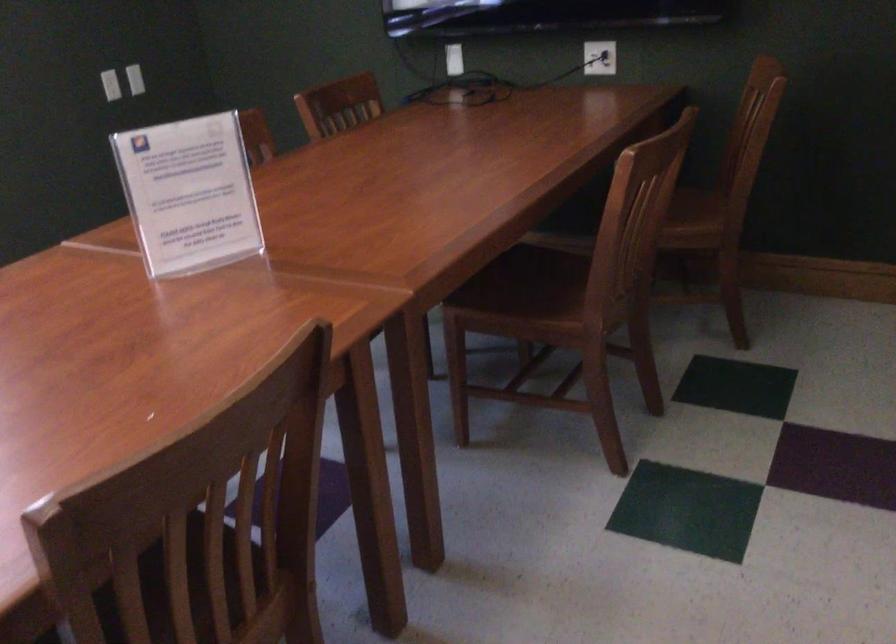
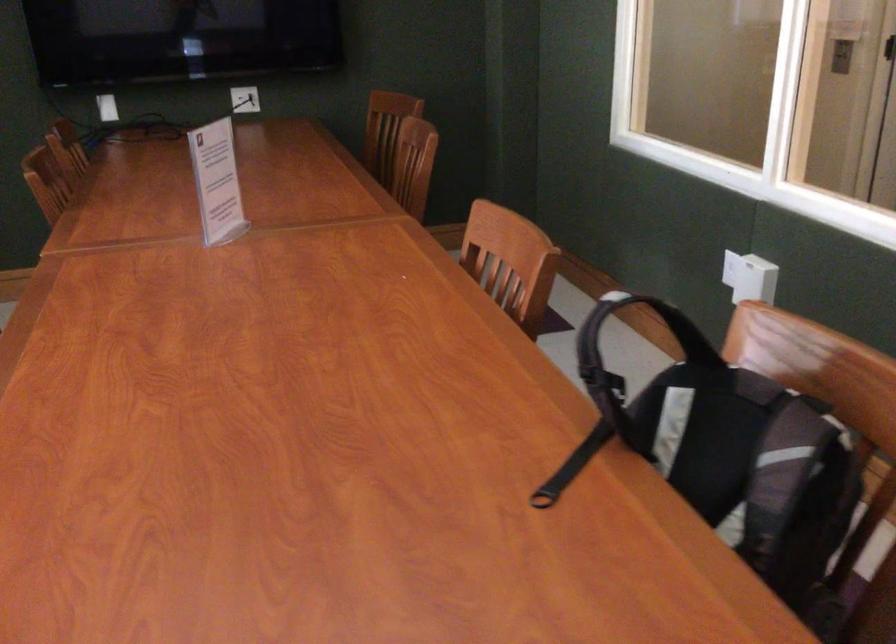
Find the pixel in the second image that matches (185,198) in the first image.

(217, 182)